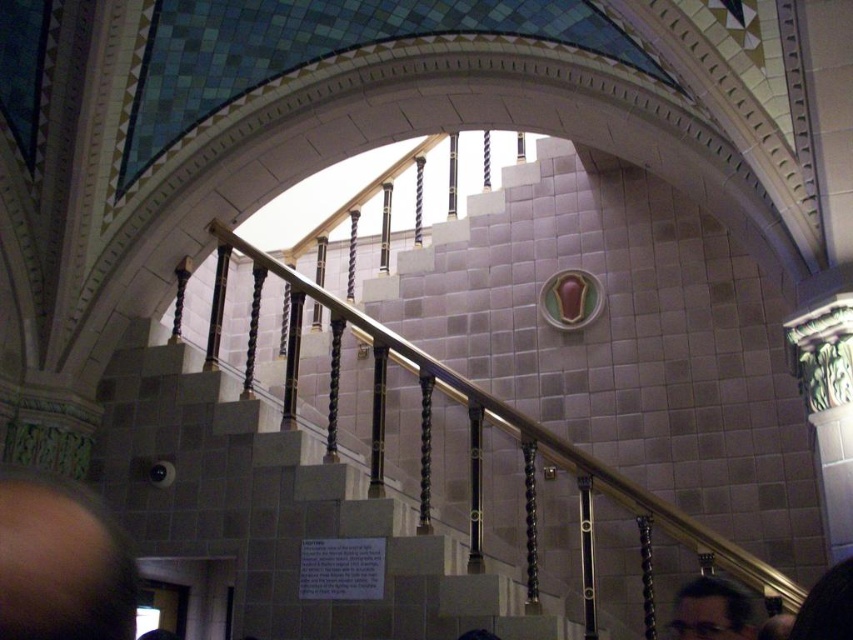
You are an architect designing a new staircase and want to ensure there is enough space between the balusters for safety. You observe two people in the image with brown hair at lower left and dark brown hair at lower right. Which person has a narrower hair width that might require adjusting the baluster spacing?

The brown hair at lower left has a lesser width compared to dark brown hair at lower right, so the person with brown hair at lower left has narrower hair and may require adjusting the baluster spacing.

You are standing at the base of the staircase in this grand structure and notice two people at the bottom of the stairs. One has dark brown hair at lower right and the other has black hair at lower right. From your perspective, which person is positioned more to the right?

The dark brown hair at lower right is positioned to the right of the black hair at lower right, so the person with dark brown hair at lower right is more to the right.

You are standing at the base of the gray stone stairs at center in a grand building. You want to take a photo of the stairs from a distance. If your camera can capture objects up to 70 feet away, will you be able to take a clear photo of the stairs from your current position?

The gray stone stairs at center and camera are 69.88 feet apart, which is within the camera range of 70 feet. Therefore, you can take a clear photo of the stairs from your current position.